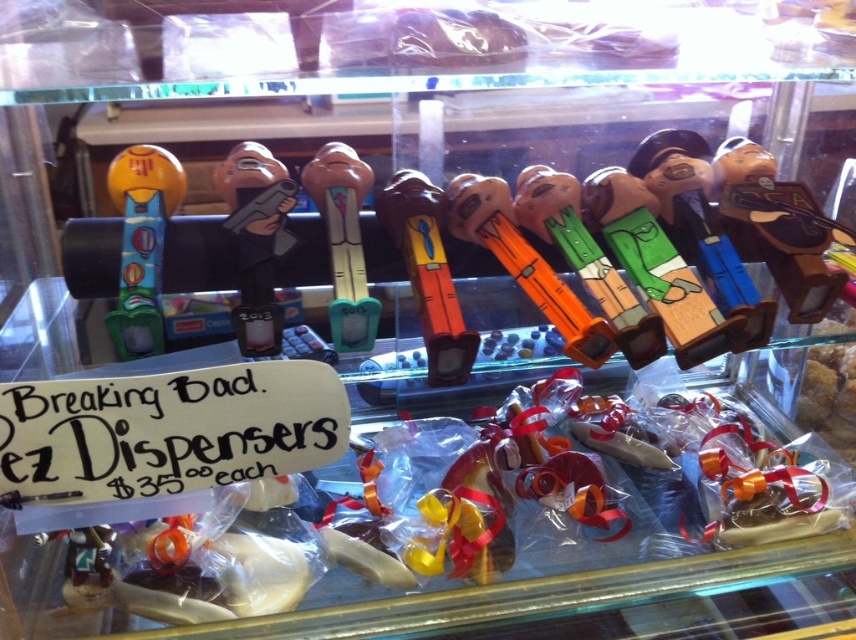
Question: Which of these objects is positioned closest to the orange plastic toy at center?

Choices:
 (A) wooden gun at center
 (B) orange wood toy gun at center
 (C) wooden toy gun at center-right

Answer: (B)

Question: Can you confirm if wooden toy gun at center-right is positioned above matte plastic dispenser at left?

Choices:
 (A) no
 (B) yes

Answer: (B)

Question: Which of the following is the farthest from the observer?

Choices:
 (A) (497, 216)
 (B) (244, 180)
 (C) (749, 202)
 (D) (137, 465)

Answer: (C)

Question: Does orange wood toy gun at center come behind matte plastic toy at center?

Choices:
 (A) yes
 (B) no

Answer: (B)

Question: Which object is the farthest from the white paper sign at lower left?

Choices:
 (A) wooden toy gun at center-right
 (B) orange plastic toy at center

Answer: (A)

Question: Is white paper sign at lower left thinner than wooden gun at center?

Choices:
 (A) yes
 (B) no

Answer: (B)